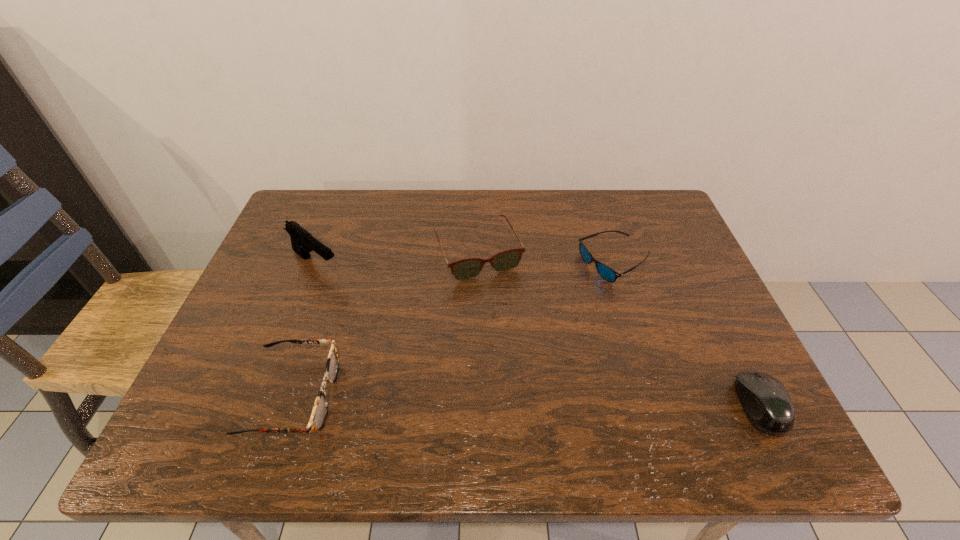
Find the location of a particular element. free region located at the front view of the third object from right to left is located at coordinates (525, 356).

The width and height of the screenshot is (960, 540). I want to click on vacant space located at the front view of the third object from right to left, so click(x=524, y=353).

Locate an element on the screen. The image size is (960, 540). vacant region located on the front-facing side of the pistol is located at coordinates (361, 298).

The image size is (960, 540). What are the coordinates of `free space located 0.300m on the front-facing side of the pistol` in the screenshot? It's located at (413, 339).

Where is `vacant space positioned 0.100m on the front-facing side of the pistol`? vacant space positioned 0.100m on the front-facing side of the pistol is located at coordinates (359, 296).

Where is `vacant region located at the front of the shortest object showing the lenses`? The width and height of the screenshot is (960, 540). vacant region located at the front of the shortest object showing the lenses is located at coordinates (x=572, y=381).

Where is `vacant space located at the front of the shortest object showing the lenses`? Image resolution: width=960 pixels, height=540 pixels. vacant space located at the front of the shortest object showing the lenses is located at coordinates (583, 349).

What are the coordinates of `vacant space positioned at the front of the shortest object showing the lenses` in the screenshot? It's located at (600, 301).

In order to click on object at the far edge in this screenshot , I will do `click(468, 268)`.

Locate an element on the screen. This screenshot has height=540, width=960. spectacles that is at the near edge is located at coordinates (320, 409).